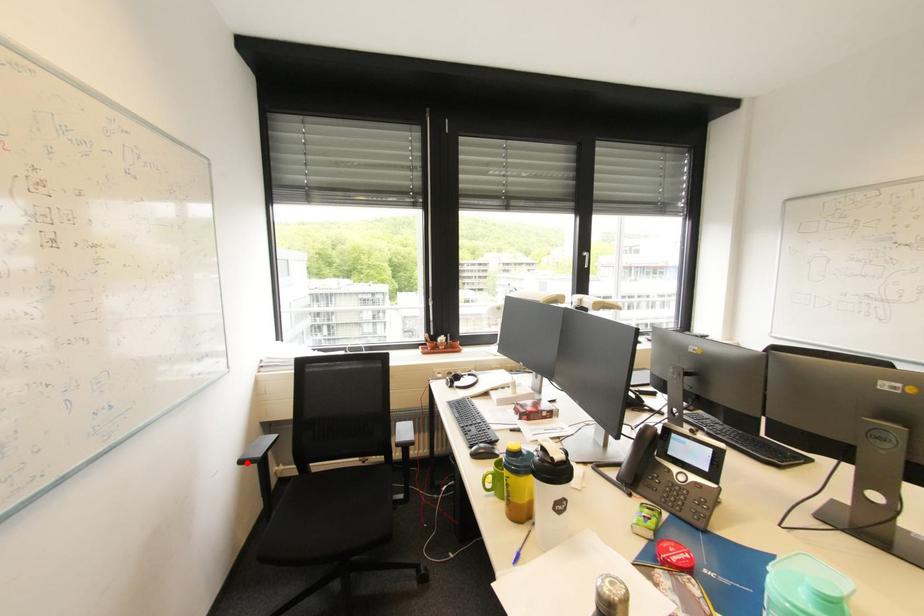
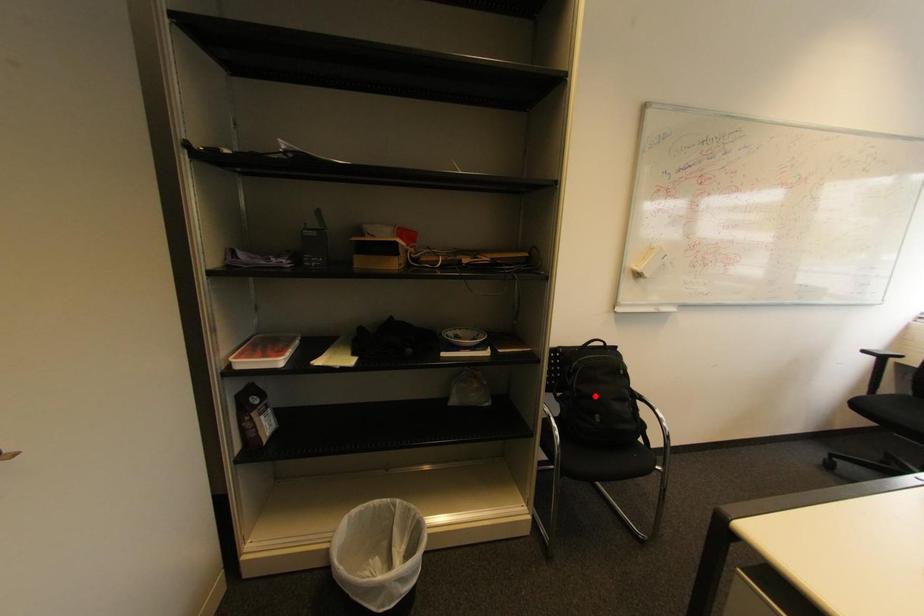
I am providing you with two images of the same scene from different viewpoints. A red point is marked on the first image and another point is marked on the second image. Is the red point in image1 aligned with the point shown in image2?

No